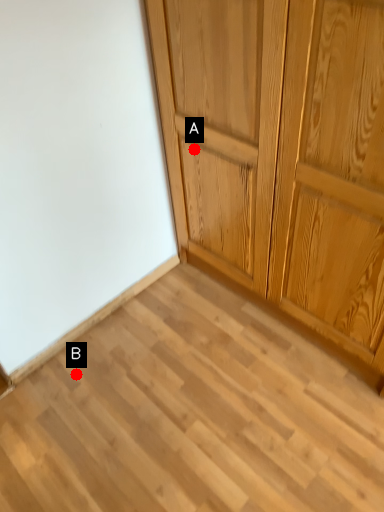
Question: Two points are circled on the image, labeled by A and B beside each circle. Which point appears closest to the camera in this image?

Choices:
 (A) A is closer
 (B) B is closer

Answer: (A)